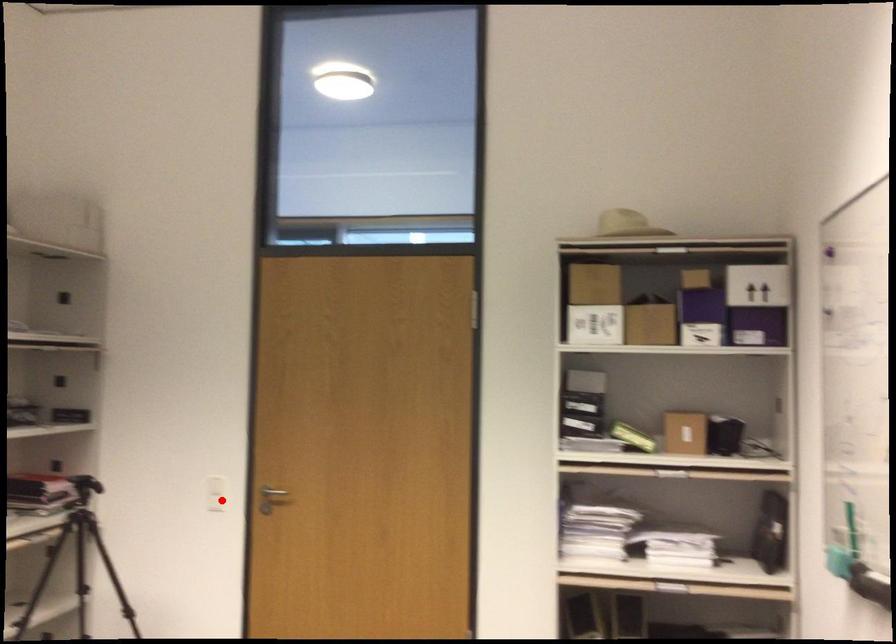
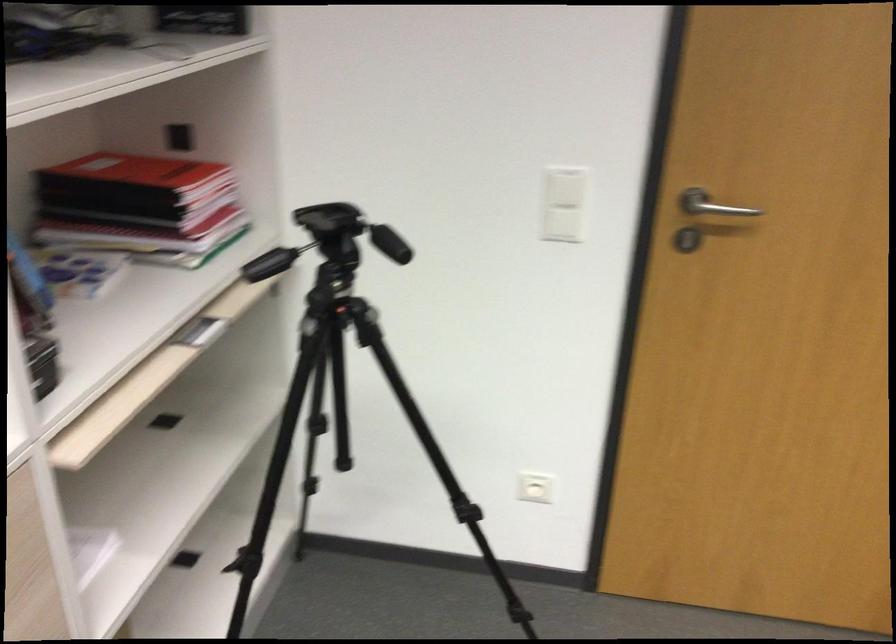
Locate, in the second image, the point that corresponds to the highlighted location in the first image.

(563, 225)